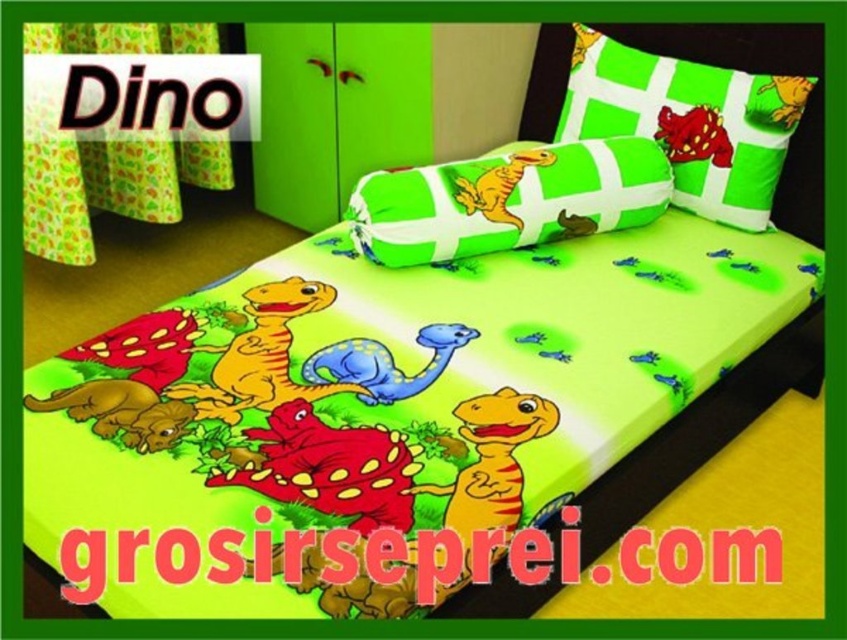
Can you confirm if blue rubber dinosaur at center is wider than brown matte dinosaur at lower left?

Correct, the width of blue rubber dinosaur at center exceeds that of brown matte dinosaur at lower left.

Does blue rubber dinosaur at center lie in front of brown matte dinosaur at lower left?

That is False.

The width and height of the screenshot is (847, 640). Find the location of `blue rubber dinosaur at center`. blue rubber dinosaur at center is located at coordinates (385, 364).

Does green fabric pillow with dinosaur prints at upper center appear on the left side of matte yellow dinosaur at center?

Incorrect, green fabric pillow with dinosaur prints at upper center is not on the left side of matte yellow dinosaur at center.

Between green fabric pillow with dinosaur prints at upper center and matte yellow dinosaur at center, which one has less height?

Standing shorter between the two is matte yellow dinosaur at center.

Who is more forward, (787, 104) or (471, 193)?

Positioned in front is point (471, 193).

Identify the location of green fabric pillow with dinosaur prints at upper center. The image size is (847, 640). click(x=690, y=122).

Who is positioned more to the right, green fabric pillow with dinosaur prints at upper center or brown matte dinosaur at lower left?

From the viewer's perspective, green fabric pillow with dinosaur prints at upper center appears more on the right side.

Locate an element on the screen. green fabric pillow with dinosaur prints at upper center is located at coordinates (690, 122).

Which is in front, point (722, 204) or point (70, 410)?

Positioned in front is point (70, 410).

At what (x,y) coordinates should I click in order to perform the action: click on green fabric pillow with dinosaur prints at upper center. Please return your answer as a coordinate pair (x, y). The width and height of the screenshot is (847, 640). Looking at the image, I should click on (690, 122).